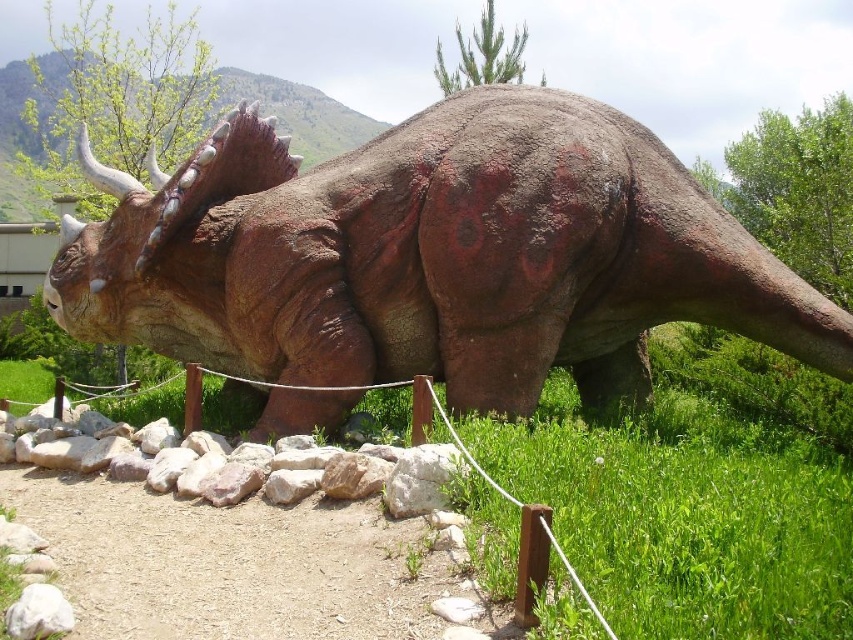
You are a tour guide leading a group of children. You want to ensure they stay at least 1.5 meters away from the rustic stone triceratops at center for safety. Can the children safely stand on the green grass at lower right without violating the safety distance?

The distance between the rustic stone triceratops at center and the green grass at lower right is 1.62 meters, which is more than the required 1.5 meters. Therefore, the children can safely stand on the green grass at lower right while maintaining the safety distance.

In the scene shown: You are standing at the point marked as point (433, 257) in the image. What object is located exactly at that point?

The point (433, 257) is exactly where the rustic stone triceratops at center is located.

You are standing in front of the Triceratops model in the park. You want to take a photo of the model without getting too close to the rope barrier. The camera you have can focus on objects up to 4 meters away. Is the point at coordinate point (x=498, y=330) within the camera focus range?

The distance of point (x=498, y=330) from viewer is 4.17 meters, so the point is slightly beyond the camera focus range of 4 meters. You might need to adjust your position to be closer to the model or use a different camera setting to capture the point clearly.